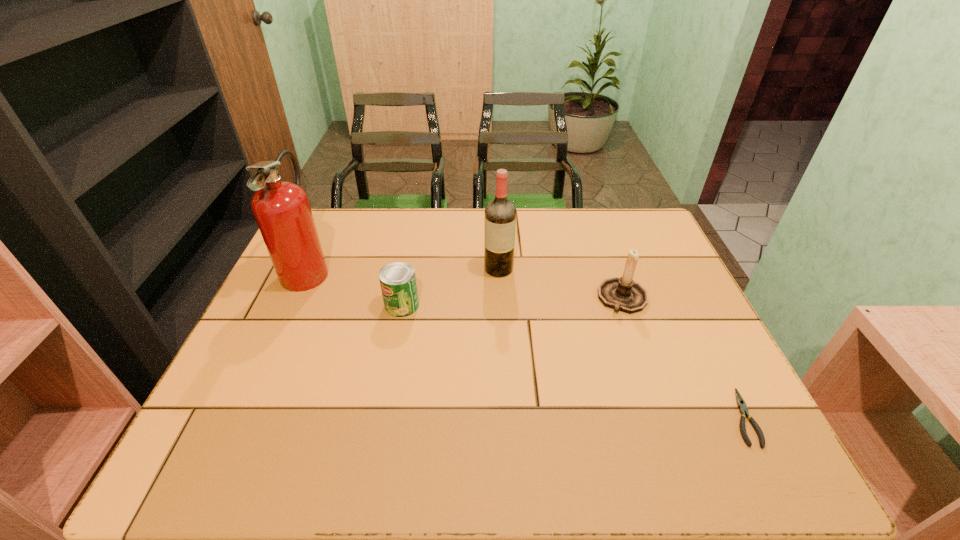
You are a GUI agent. You are given a task and a screenshot of the screen. Output one action in this format:
    pyautogui.click(x=<x>, y=<y>)
    Task: Click on the fire extinguisher
    
    Given the screenshot: What is the action you would take?
    pyautogui.click(x=282, y=210)

Where is `the tallest object`? The height and width of the screenshot is (540, 960). the tallest object is located at coordinates (282, 210).

The height and width of the screenshot is (540, 960). I want to click on liquor, so click(x=500, y=214).

This screenshot has width=960, height=540. I want to click on the second tallest object, so click(x=500, y=214).

This screenshot has height=540, width=960. Identify the location of candle holder. [x=622, y=294].

Where is `the third tallest object`? the third tallest object is located at coordinates (622, 294).

Identify the location of can. (397, 280).

I want to click on the second object from left to right, so click(x=397, y=280).

Find the location of `the rightmost object`. the rightmost object is located at coordinates (743, 410).

Identify the location of the shortest object. (743, 410).